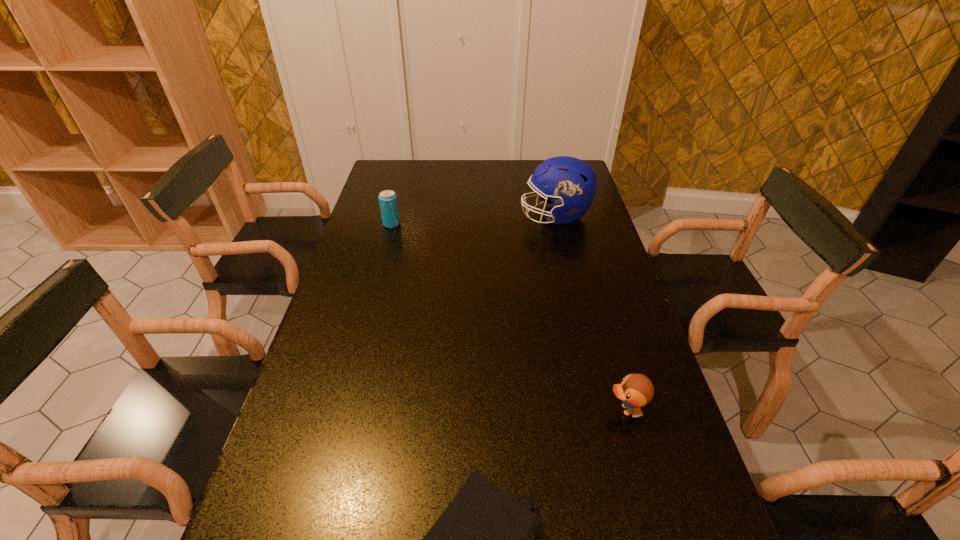
I want to click on object that stands as the second closest to the duck, so click(x=571, y=183).

Select which object is the second closest to the soda can. Please provide its 2D coordinates. Your answer should be formatted as a tuple, i.e. [(x, y)], where the tuple contains the x and y coordinates of a point satisfying the conditions above.

[(636, 390)]